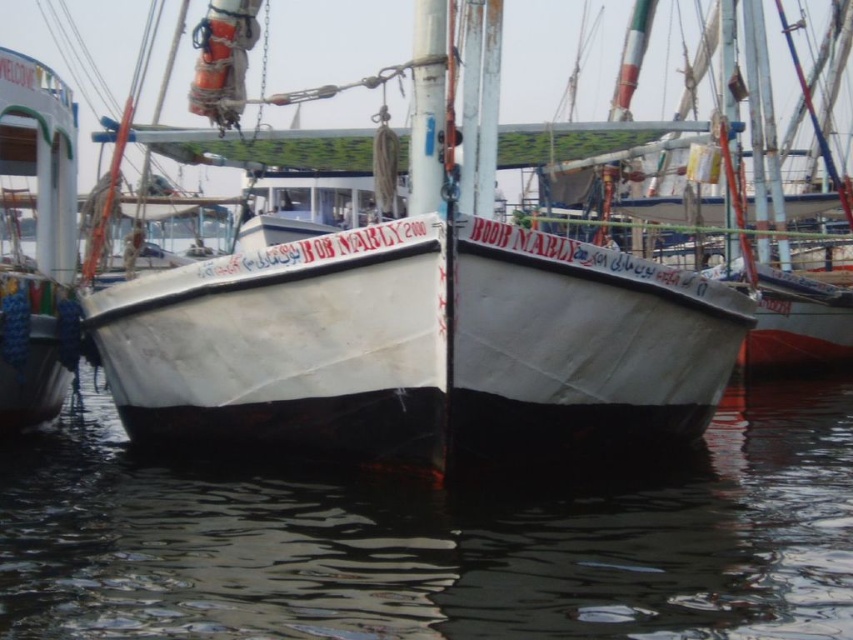
You are a dock worker who needs to secure both the white matte boat at center and the white matte boat at left. Since you have limited rope, you want to know which boat requires less rope to secure around its height. Which boat should you prioritize?

The white matte boat at center has a lesser height compared to the white matte boat at left, so it requires less rope to secure around its height. You should prioritize securing the white matte boat at center first.

You are a dock worker who needs to secure the black rubber water at center and the white matte boat at left. Since you have limited space, which object requires more area to secure properly?

The white matte boat at left requires more area to secure properly because the black rubber water at center is smaller than it.

You are a sailor who needs to secure a life ring. You see a black rubber water at center and a white matte boat at center. Which object should you place the life ring on?

The life ring should be placed on the white matte boat at center because the black rubber water at center is actually water and not a solid surface.